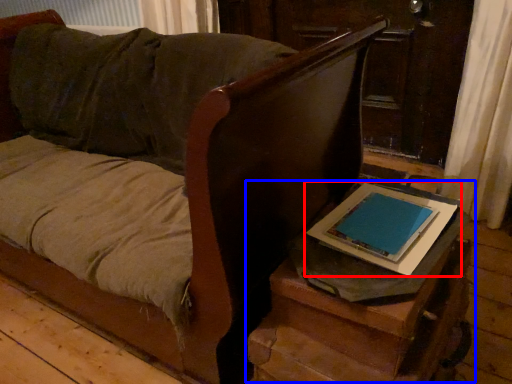
Question: Which of the following is the closest to the observer, tablet computer (highlighted by a red box) or table (highlighted by a blue box)?

Choices:
 (A) tablet computer
 (B) table

Answer: (B)